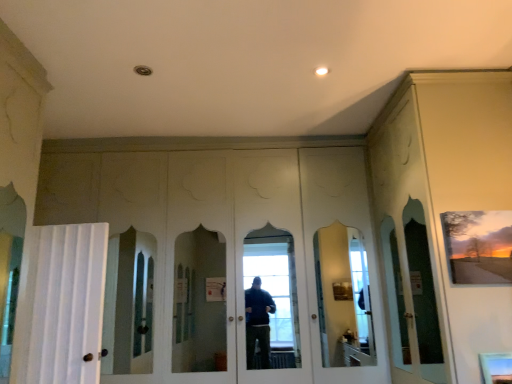
The width and height of the screenshot is (512, 384). What are the coordinates of `matte wooden picture frame at upper right` in the screenshot? It's located at (478, 246).

Where is `matte glass window at lower right`? Image resolution: width=512 pixels, height=384 pixels. matte glass window at lower right is located at coordinates (496, 367).

Describe the element at coordinates (63, 305) in the screenshot. I see `white fabric curtain at left` at that location.

Find the location of `matte wooden picture frame at upper right`. matte wooden picture frame at upper right is located at coordinates (478, 246).

Can you confirm if matte wooden picture frame at upper right is thinner than matte glass window at lower right?

Correct, the width of matte wooden picture frame at upper right is less than that of matte glass window at lower right.

Is matte wooden picture frame at upper right spatially inside matte glass window at lower right, or outside of it?

matte wooden picture frame at upper right is outside matte glass window at lower right.

From the image's perspective, does matte wooden picture frame at upper right appear lower than matte glass window at lower right?

No.

Consider the image. Does matte wooden picture frame at upper right have a greater height compared to matte glass window at lower right?

Correct, matte wooden picture frame at upper right is much taller as matte glass window at lower right.

Does matte glass window at lower right lie in front of white fabric curtain at left?

Yes, the depth of matte glass window at lower right is less than that of white fabric curtain at left.

Is matte glass window at lower right to the left of white fabric curtain at left from the viewer's perspective?

Incorrect, matte glass window at lower right is not on the left side of white fabric curtain at left.

Considering the sizes of objects matte glass window at lower right and white fabric curtain at left in the image provided, who is bigger, matte glass window at lower right or white fabric curtain at left?

Bigger between the two is white fabric curtain at left.

Are matte glass window at lower right and white fabric curtain at left located far from each other?

matte glass window at lower right is positioned a significant distance from white fabric curtain at left.

Is white fabric curtain at left located outside matte wooden picture frame at upper right?

Indeed, white fabric curtain at left is completely outside matte wooden picture frame at upper right.

Is point (36, 373) more distant than point (466, 264)?

Yes, it is.

Between white fabric curtain at left and matte wooden picture frame at upper right, which one appears on the right side from the viewer's perspective?

→ matte wooden picture frame at upper right.

Which object is more forward, white fabric curtain at left or matte wooden picture frame at upper right?

matte wooden picture frame at upper right.

What's the angular difference between matte wooden picture frame at upper right and white fabric curtain at left's facing directions?

They differ by 9.34 degrees in their facing directions.

Is matte wooden picture frame at upper right facing towards white fabric curtain at left?

No.

From the picture: From a real-world perspective, does matte wooden picture frame at upper right sit lower than white fabric curtain at left?

Actually, matte wooden picture frame at upper right is physically above white fabric curtain at left in the real world.

Can you confirm if matte wooden picture frame at upper right is wider than white fabric curtain at left?

No.

Can you see white fabric curtain at left touching matte glass window at lower right?

They are not placed beside each other.

From the image's perspective, is white fabric curtain at left under matte glass window at lower right?

Incorrect, from the image's perspective, white fabric curtain at left is higher than matte glass window at lower right.

How distant is white fabric curtain at left from matte glass window at lower right?

A distance of 2.83 meters exists between white fabric curtain at left and matte glass window at lower right.

Can matte glass window at lower right be found inside white fabric curtain at left?

No, matte glass window at lower right is located outside of white fabric curtain at left.

From a real-world perspective, is matte glass window at lower right positioned above or below matte wooden picture frame at upper right?

matte glass window at lower right is below matte wooden picture frame at upper right.

Does matte glass window at lower right lie behind matte wooden picture frame at upper right?

No, the depth of matte glass window at lower right is less than that of matte wooden picture frame at upper right.

Based on the photo, would you say matte glass window at lower right is a long distance from matte wooden picture frame at upper right?

matte glass window at lower right is actually quite close to matte wooden picture frame at upper right.

Based on their positions, is matte glass window at lower right located to the left or right of matte wooden picture frame at upper right?

Clearly, matte glass window at lower right is on the right of matte wooden picture frame at upper right in the image.

I want to click on picture frame positioned vertically above the matte glass window at lower right (from a real-world perspective), so click(x=478, y=246).

Find the location of a particular element. window in front of the white fabric curtain at left is located at coordinates (496, 367).

Based on their spatial positions, is matte glass window at lower right or matte wooden picture frame at upper right further from white fabric curtain at left?

matte glass window at lower right is positioned further to the anchor white fabric curtain at left.

Which object lies nearer to the anchor point matte wooden picture frame at upper right, white fabric curtain at left or matte glass window at lower right?

matte glass window at lower right is positioned closer to the anchor matte wooden picture frame at upper right.

Which object lies nearer to the anchor point white fabric curtain at left, matte wooden picture frame at upper right or matte glass window at lower right?

Based on the image, matte wooden picture frame at upper right appears to be nearer to white fabric curtain at left.

Looking at the image, which one is located closer to matte wooden picture frame at upper right, matte glass window at lower right or white fabric curtain at left?

matte glass window at lower right is closer to matte wooden picture frame at upper right.

Considering their positions, is white fabric curtain at left positioned further to matte glass window at lower right than matte wooden picture frame at upper right?

white fabric curtain at left is further to matte glass window at lower right.

From the image, which object appears to be farther from matte glass window at lower right, matte wooden picture frame at upper right or white fabric curtain at left?

white fabric curtain at left lies further to matte glass window at lower right than the other object.

This screenshot has height=384, width=512. I want to click on picture frame between white fabric curtain at left and matte glass window at lower right from left to right, so click(x=478, y=246).